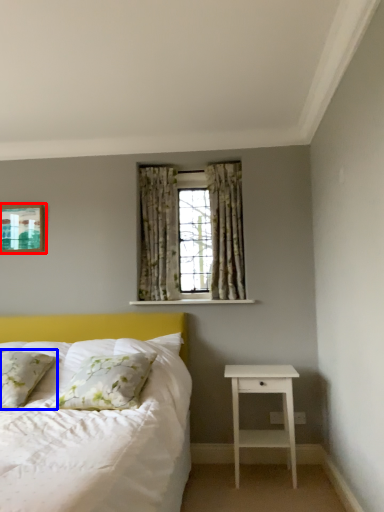
Question: Which point is further to the camera, picture frame (highlighted by a red box) or pillow (highlighted by a blue box)?

Choices:
 (A) picture frame
 (B) pillow

Answer: (A)